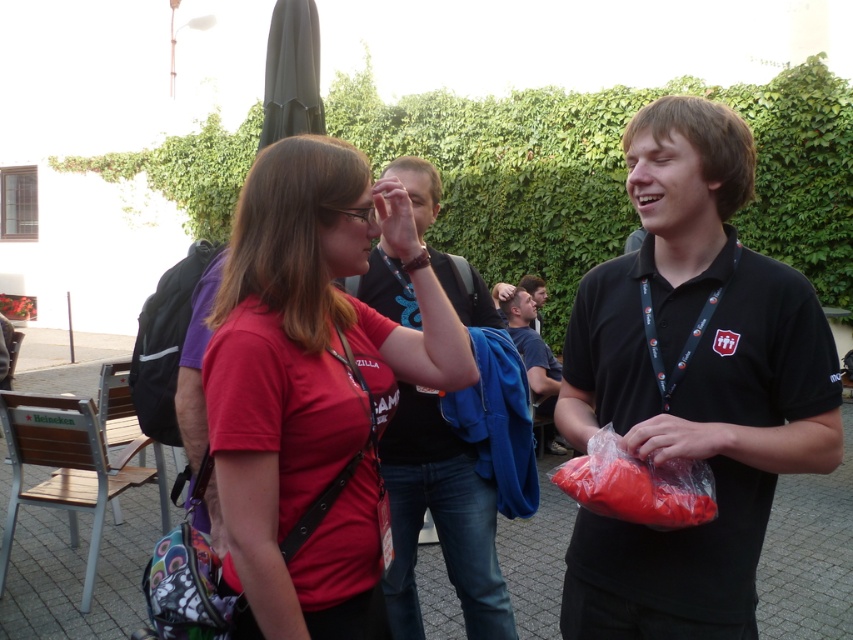
Measure the distance between black cotton shirt at center and translucent plastic bag at center.

black cotton shirt at center is 28.35 inches away from translucent plastic bag at center.

Between point (416, 321) and point (614, 451), which one is positioned in front?

Point (614, 451) is more forward.

I want to click on black cotton shirt at center, so click(440, 518).

Can you confirm if translucent plastic bag at center is taller than dark blue fabric jacket at center?

Incorrect, translucent plastic bag at center's height is not larger of dark blue fabric jacket at center's.

Can you confirm if translucent plastic bag at center is positioned below dark blue fabric jacket at center?

Indeed, translucent plastic bag at center is positioned under dark blue fabric jacket at center.

You are a GUI agent. You are given a task and a screenshot of the screen. Output one action in this format:
    pyautogui.click(x=<x>, y=<y>)
    Task: Click on the translucent plastic bag at center
    Image resolution: width=853 pixels, height=640 pixels.
    Given the screenshot: What is the action you would take?
    pyautogui.click(x=637, y=484)

This screenshot has width=853, height=640. What are the coordinates of `translucent plastic bag at center` in the screenshot? It's located at (637, 484).

Who is positioned more to the left, black matte shirt at center or matte red shirt at center?

matte red shirt at center is more to the left.

Can you confirm if black matte shirt at center is bigger than matte red shirt at center?

Yes, black matte shirt at center is bigger than matte red shirt at center.

The width and height of the screenshot is (853, 640). What do you see at coordinates (691, 385) in the screenshot? I see `black matte shirt at center` at bounding box center [691, 385].

Identify the location of black matte shirt at center. Image resolution: width=853 pixels, height=640 pixels. (691, 385).